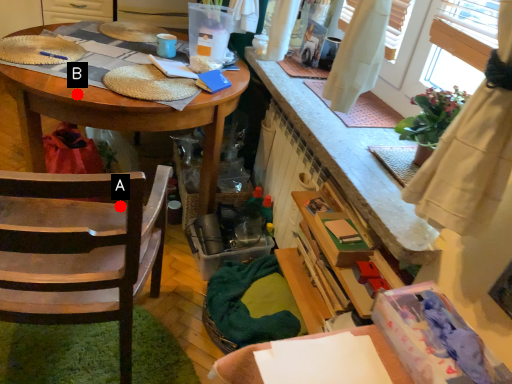
Question: Two points are circled on the image, labeled by A and B beside each circle. Which point appears closest to the camera in this image?

Choices:
 (A) A is closer
 (B) B is closer

Answer: (A)